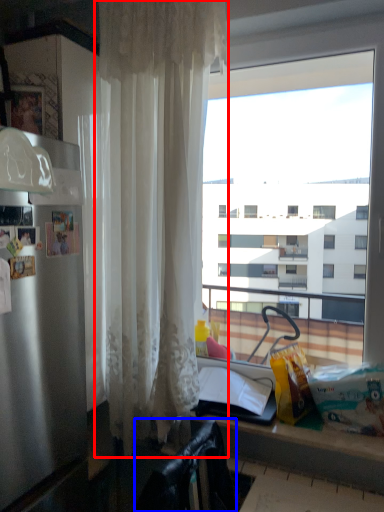
Question: Among these objects, which one is farthest to the camera, curtain (highlighted by a red box) or chair (highlighted by a blue box)?

Choices:
 (A) curtain
 (B) chair

Answer: (A)